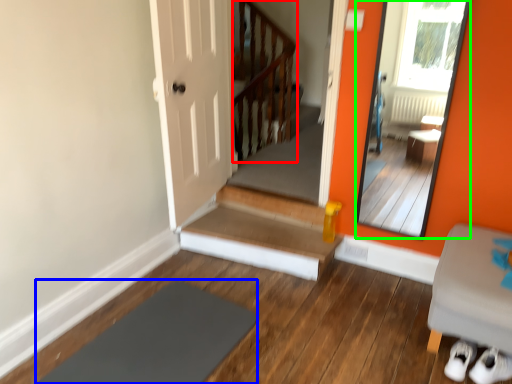
Question: Which object is positioned farthest from balustrade (highlighted by a red box)? Select from slate (highlighted by a blue box) and mirror (highlighted by a green box).

Choices:
 (A) slate
 (B) mirror

Answer: (A)